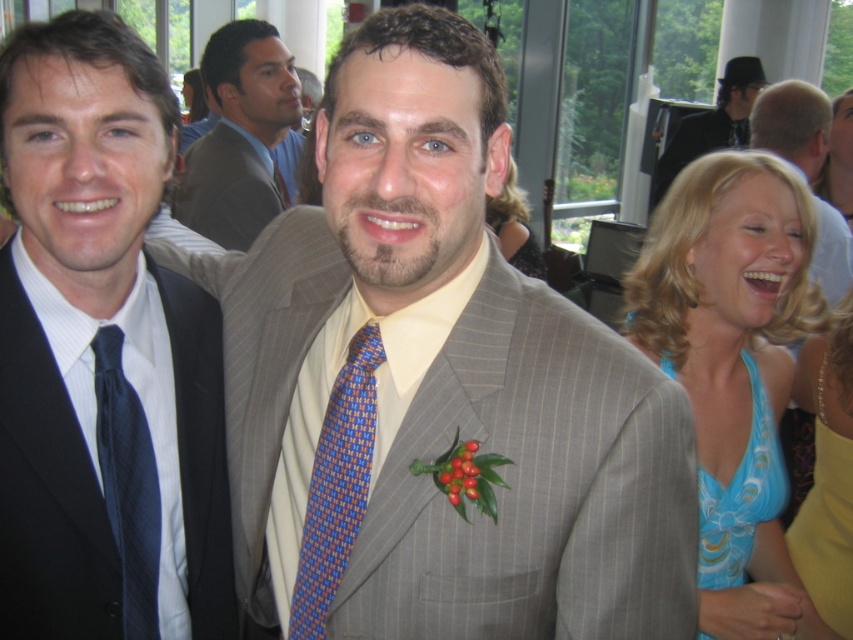
The width and height of the screenshot is (853, 640). Find the location of `matte black suit at left`. matte black suit at left is located at coordinates (122, 264).

Can you confirm if matte black suit at left is positioned above matte brown suit at upper center?

Actually, matte black suit at left is below matte brown suit at upper center.

What do you see at coordinates (122, 264) in the screenshot? This screenshot has height=640, width=853. I see `matte black suit at left` at bounding box center [122, 264].

Where is `matte black suit at left`? matte black suit at left is located at coordinates (122, 264).

You are a GUI agent. You are given a task and a screenshot of the screen. Output one action in this format:
    pyautogui.click(x=<x>, y=<y>)
    Task: Click on the blue woven tie at center
    Image resolution: width=853 pixels, height=640 pixels.
    Given the screenshot: What is the action you would take?
    pyautogui.click(x=335, y=484)

Does blue woven tie at center have a greater width compared to blue satin dress at lower right?

Incorrect, blue woven tie at center's width does not surpass blue satin dress at lower right's.

Is point (328, 570) farther from viewer compared to point (740, 490)?

No.

The image size is (853, 640). I want to click on blue woven tie at center, so click(x=335, y=484).

Measure the distance from blue floral dress at right to light gray pinstripe suit at center.

The distance of blue floral dress at right from light gray pinstripe suit at center is 5.72 feet.

The image size is (853, 640). I want to click on blue floral dress at right, so click(733, 369).

What do you see at coordinates (733, 369) in the screenshot? I see `blue floral dress at right` at bounding box center [733, 369].

Where is `blue floral dress at right`? The width and height of the screenshot is (853, 640). blue floral dress at right is located at coordinates (733, 369).